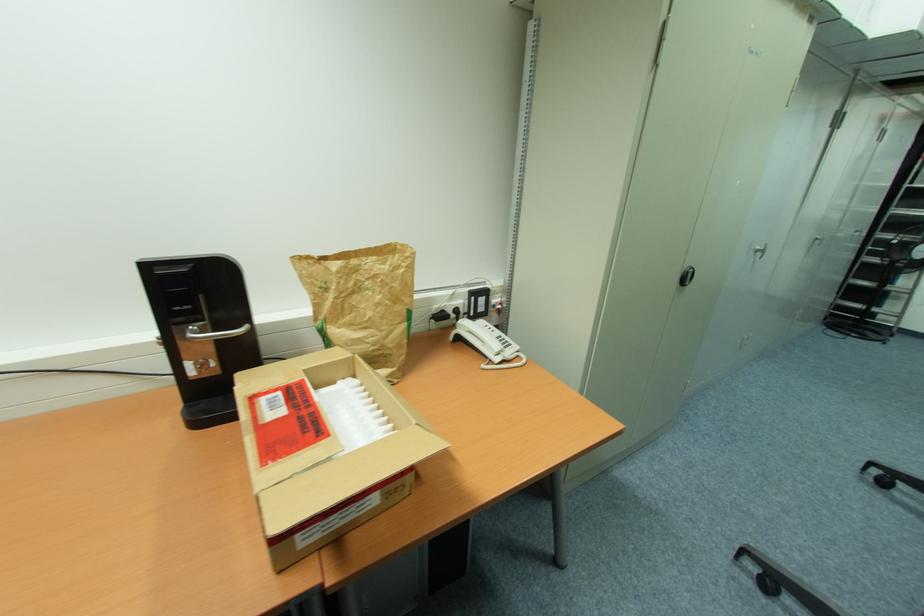
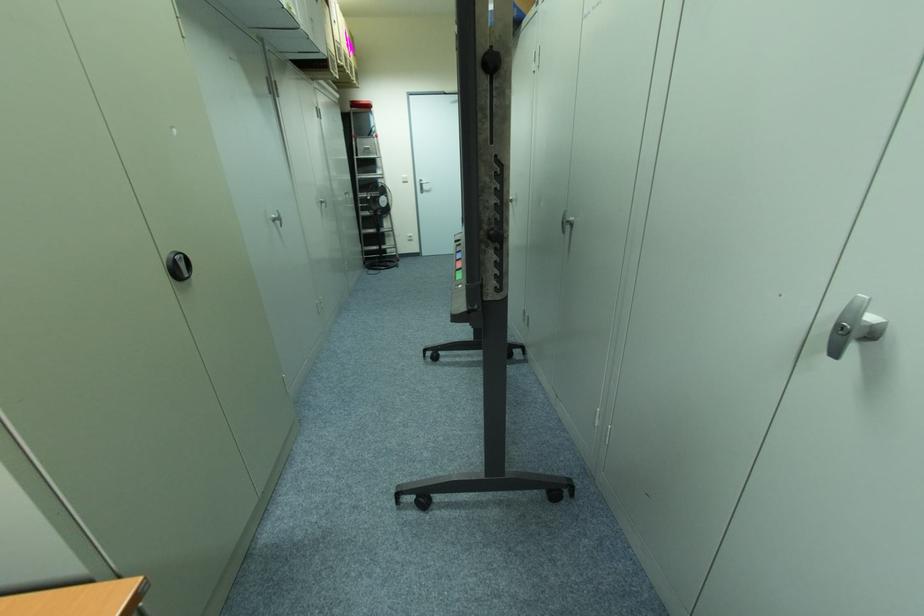
Locate, in the second image, the point that corresponds to point (758, 252) in the first image.

(274, 220)